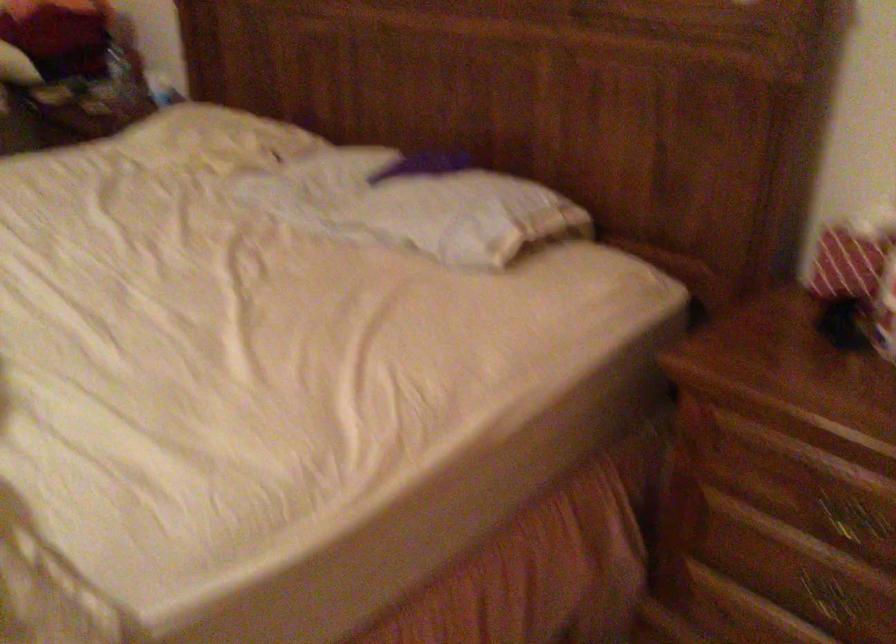
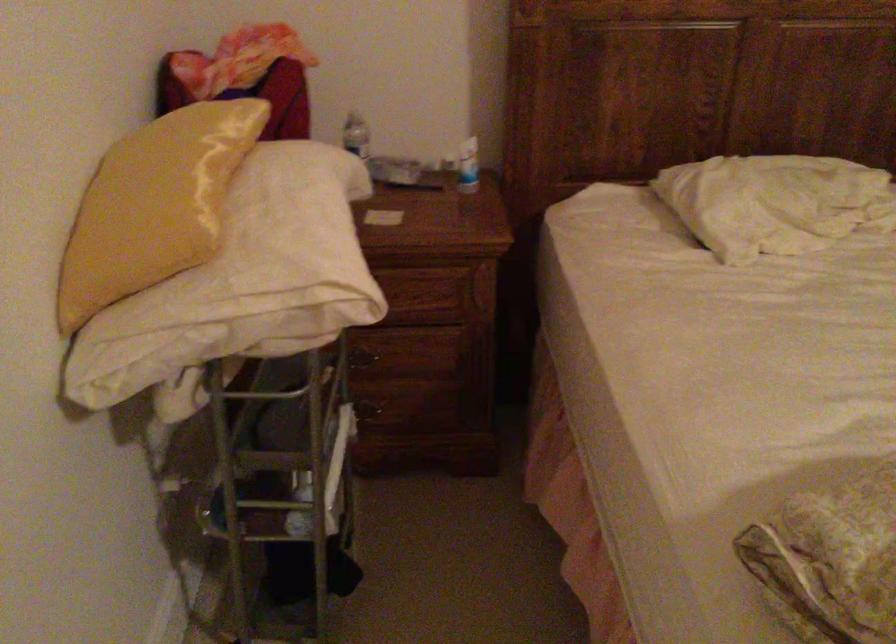
The point at (x=182, y=129) is marked in the first image. Where is the corresponding point in the second image?

(774, 202)